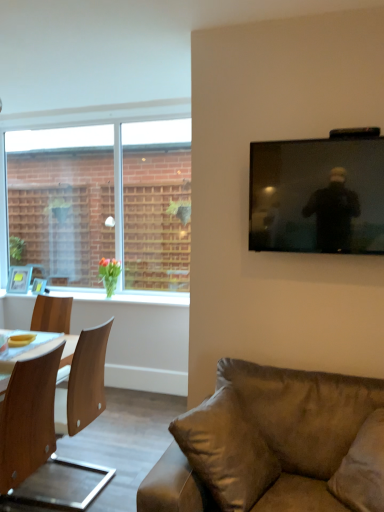
Question: Is wooden photo frame at left, placed as the 1th picture frame when sorted from left to right, looking in the opposite direction of wooden chair at left?

Choices:
 (A) no
 (B) yes

Answer: (A)

Question: From a real-world perspective, is wooden photo frame at left, the 2th picture frame viewed from the right, beneath wooden chair at left?

Choices:
 (A) no
 (B) yes

Answer: (A)

Question: Is wooden chair at left a part of wooden photo frame at left, the 2th picture frame viewed from the right?

Choices:
 (A) yes
 (B) no

Answer: (B)

Question: Is wooden photo frame at left, the 2th picture frame viewed from the right, beside wooden chair at left?

Choices:
 (A) yes
 (B) no

Answer: (B)

Question: Can you confirm if wooden photo frame at left, the 2th picture frame viewed from the right, is positioned to the right of wooden chair at left?

Choices:
 (A) no
 (B) yes

Answer: (A)

Question: Can you confirm if wooden photo frame at left, placed as the 1th picture frame when sorted from left to right, is taller than wooden chair at left?

Choices:
 (A) yes
 (B) no

Answer: (B)

Question: Is black glossy tv at upper right touching brown leather couch at lower right?

Choices:
 (A) yes
 (B) no

Answer: (B)

Question: Is black glossy tv at upper right turned away from brown leather couch at lower right?

Choices:
 (A) yes
 (B) no

Answer: (B)

Question: Is black glossy tv at upper right far away from brown leather couch at lower right?

Choices:
 (A) yes
 (B) no

Answer: (B)

Question: From a real-world perspective, does black glossy tv at upper right stand above brown leather couch at lower right?

Choices:
 (A) yes
 (B) no

Answer: (A)

Question: Is black glossy tv at upper right bigger than brown leather couch at lower right?

Choices:
 (A) yes
 (B) no

Answer: (B)

Question: From a real-world perspective, is black glossy tv at upper right under brown leather couch at lower right?

Choices:
 (A) no
 (B) yes

Answer: (A)

Question: From a real-world perspective, does black glossy tv at upper right stand above green glossy vase at left?

Choices:
 (A) no
 (B) yes

Answer: (B)